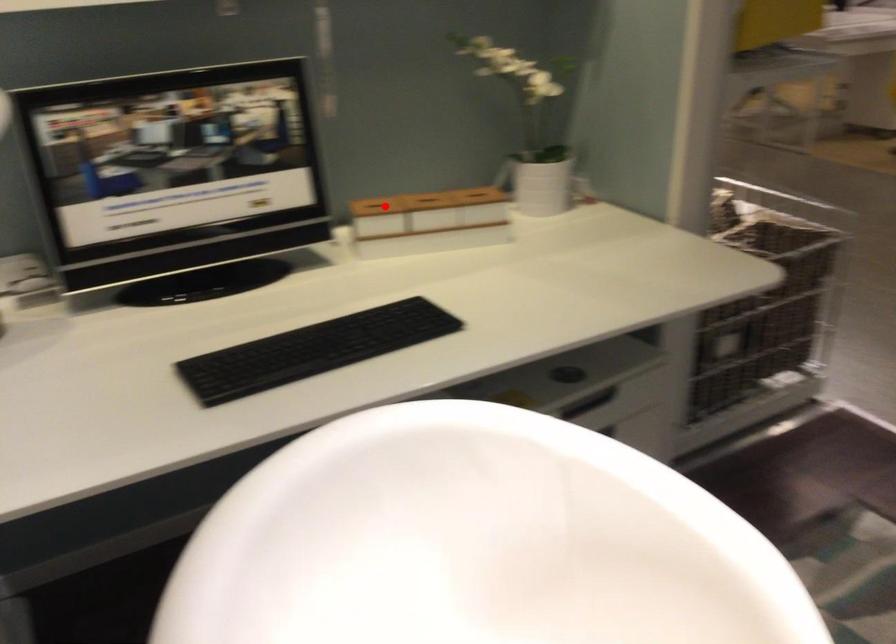
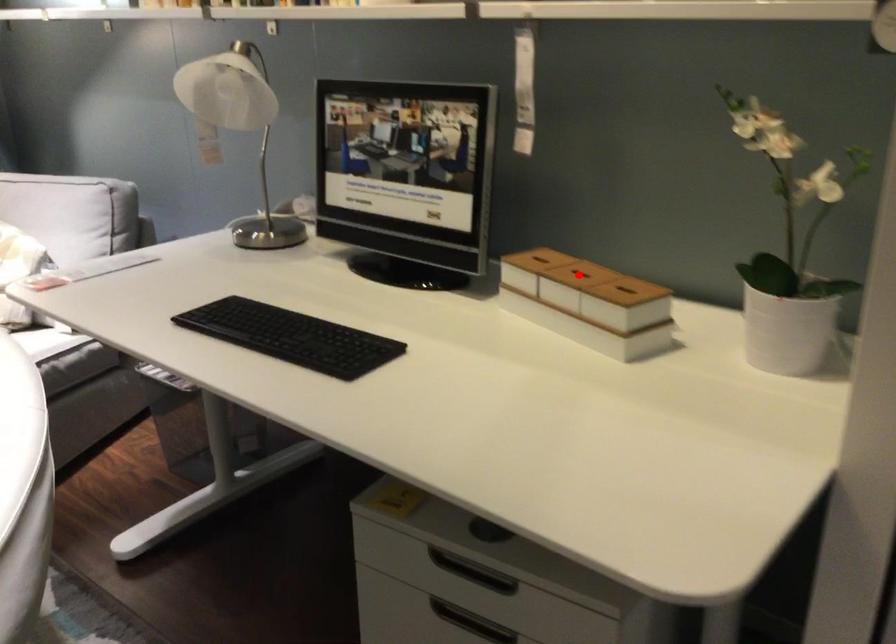
I am providing you with two images of the same scene from different viewpoints. A red point is marked on the first image and another point is marked on the second image. Is the red point in image1 aligned with the point shown in image2?

No